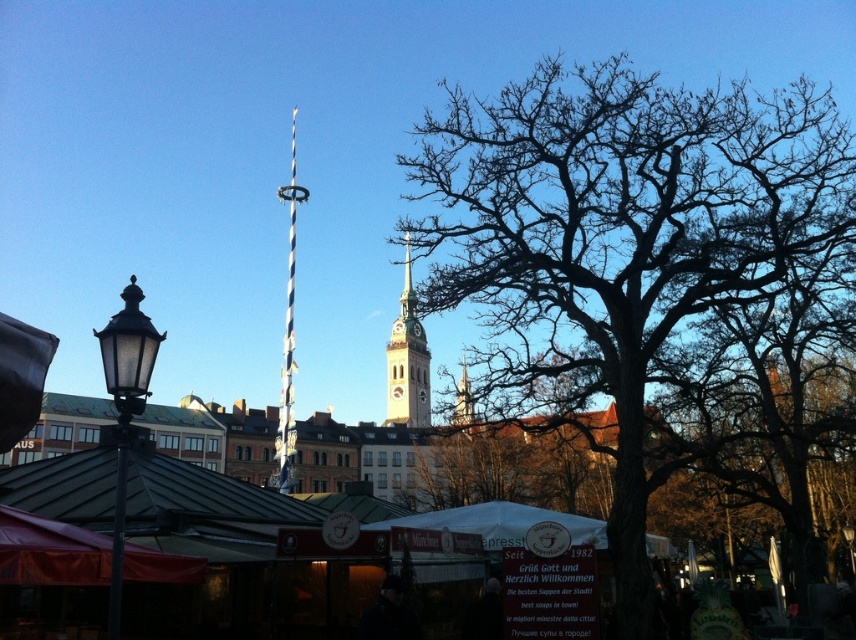
You are a vendor at the market and want to set up a new stall between the white fabric canopy at center and the blue and white striped pole at center. Given that your stall requires a space of 1.2 meters in width, can you determine if there is enough space between them based on their widths?

The white fabric canopy at center is wider than the blue and white striped pole at center. However, the exact widths are not provided, so it is impossible to determine if the space between them is sufficient for your 1.2 meter stall.

You are standing at the entrance of the market and see two points in the scene. The first point is labeled as point (508, 506) and the second is point (284, 444). Which point is closer to you?

Point (508, 506) is in front of point (284, 444), so it is closer to you.